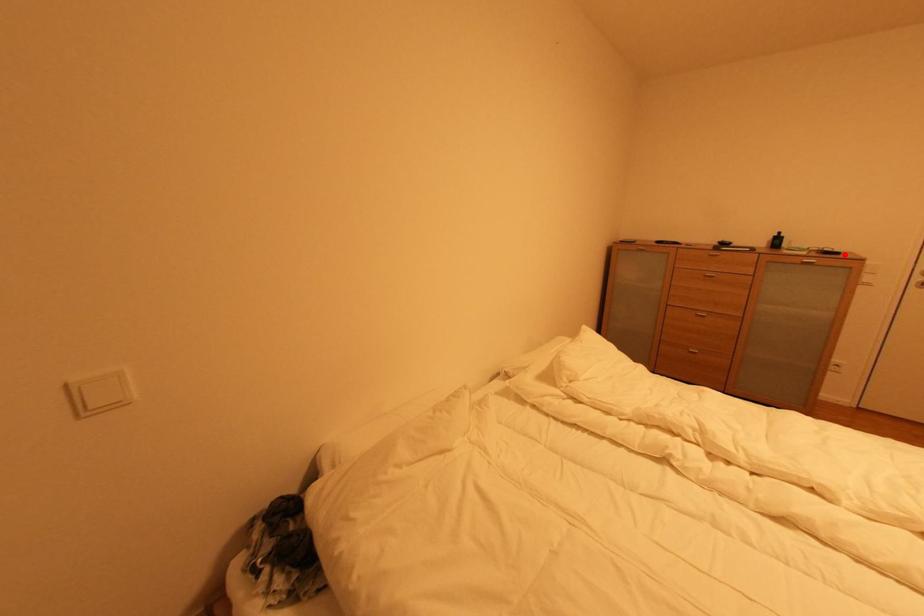
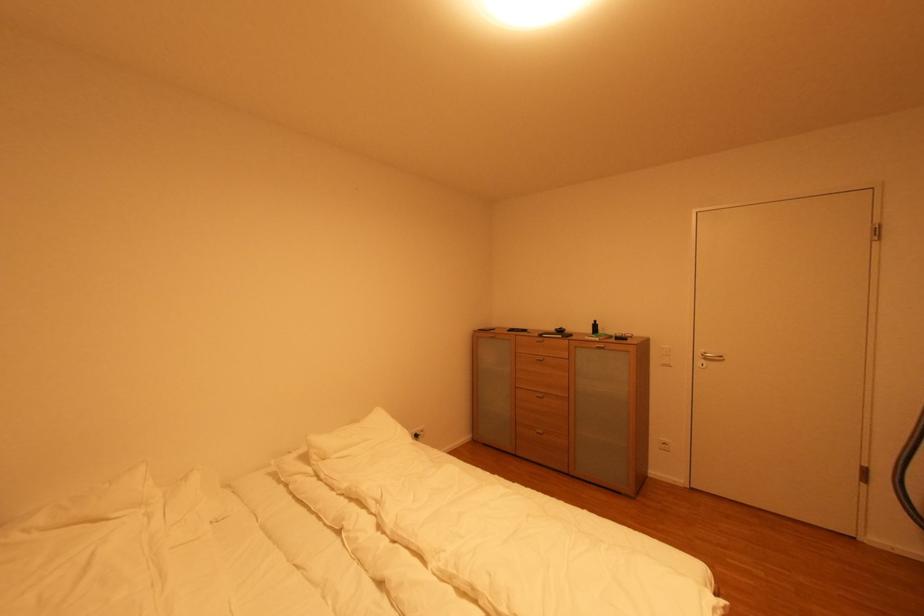
The point at the highlighted location is marked in the first image. Where is the corresponding point in the second image?

(630, 339)